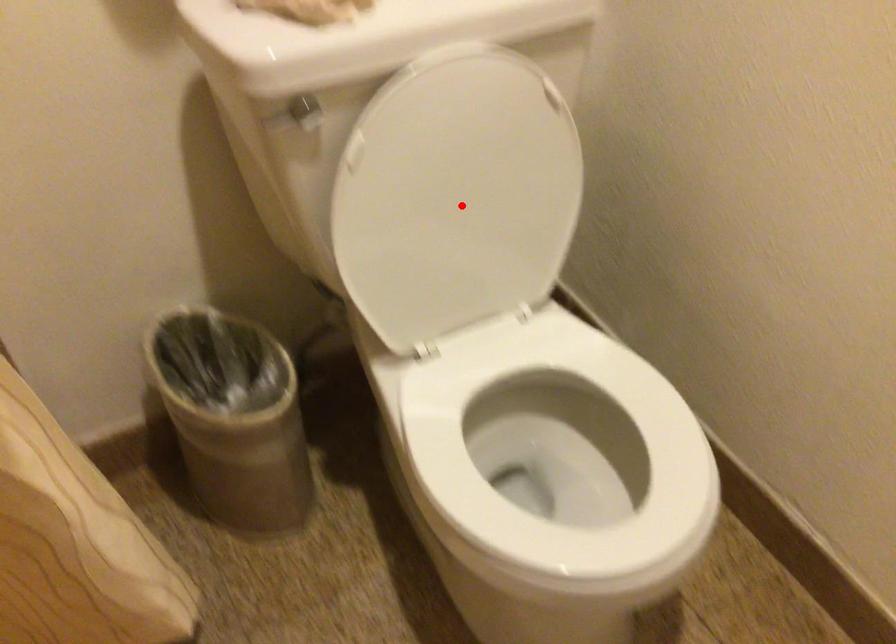
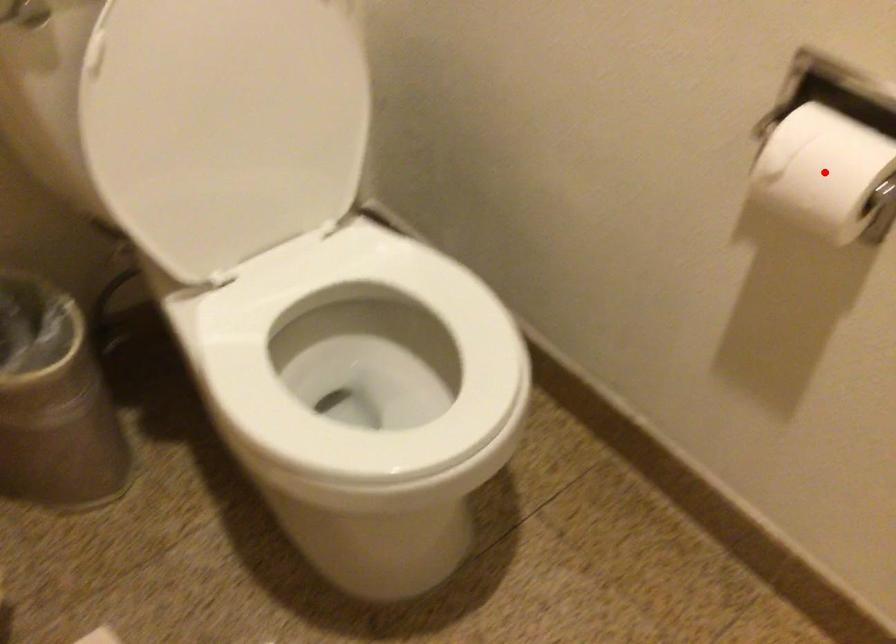
From the picture: I am providing you with two images of the same scene from different viewpoints. A red point is marked on the first image and another point is marked on the second image. Is the red point in image1 aligned with the point shown in image2?

No